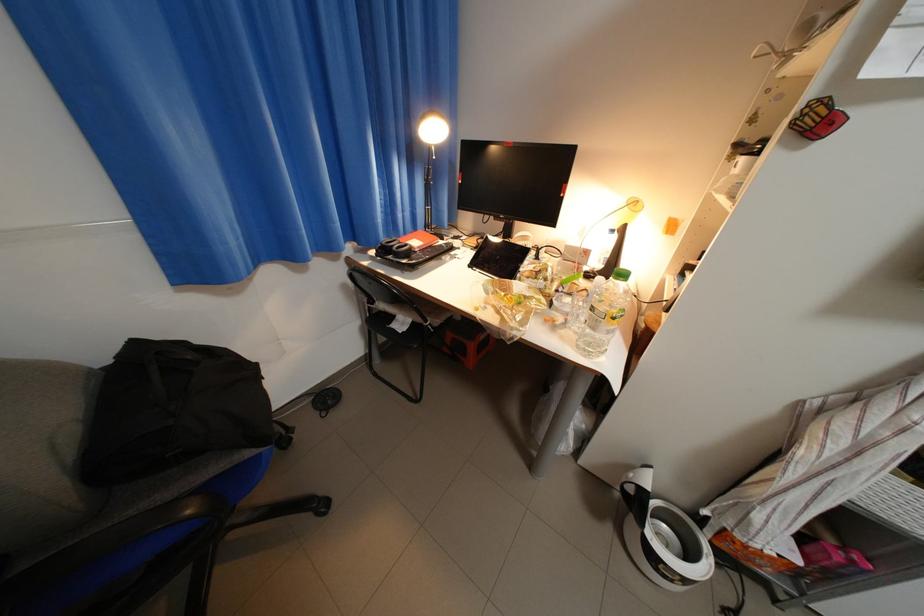
This screenshot has width=924, height=616. I want to click on black appliance handle, so click(x=514, y=179).